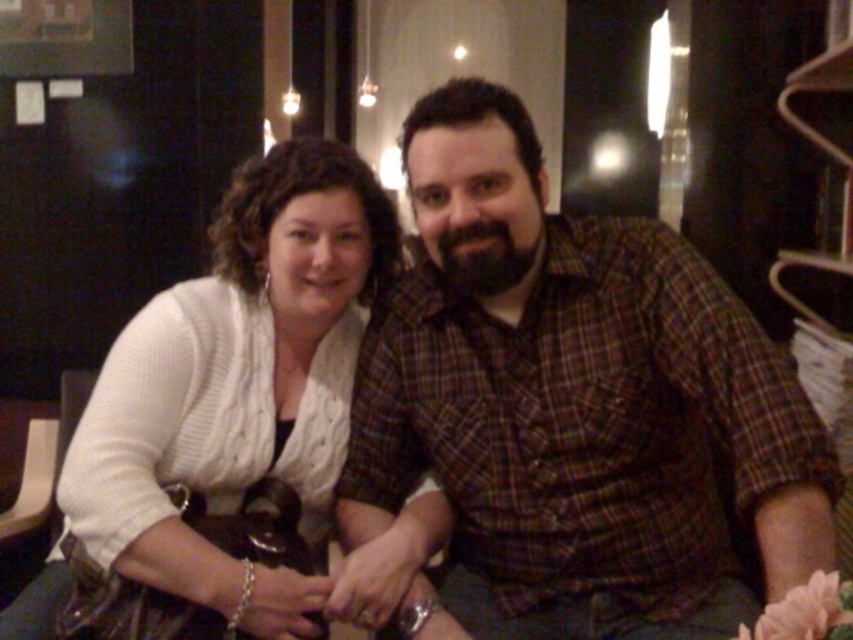
Who is positioned more to the left, plaid shirt at center or white knitted sweater at center?

white knitted sweater at center is more to the left.

The image size is (853, 640). What do you see at coordinates (577, 404) in the screenshot? I see `plaid shirt at center` at bounding box center [577, 404].

Find the location of a particular element. This screenshot has height=640, width=853. plaid shirt at center is located at coordinates (577, 404).

Where is `plaid shirt at center`? This screenshot has width=853, height=640. plaid shirt at center is located at coordinates (577, 404).